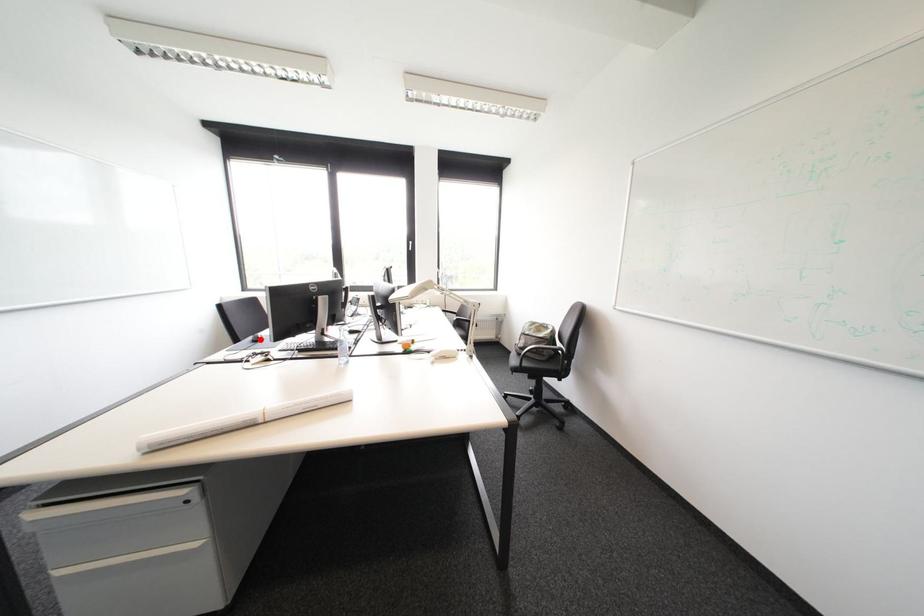
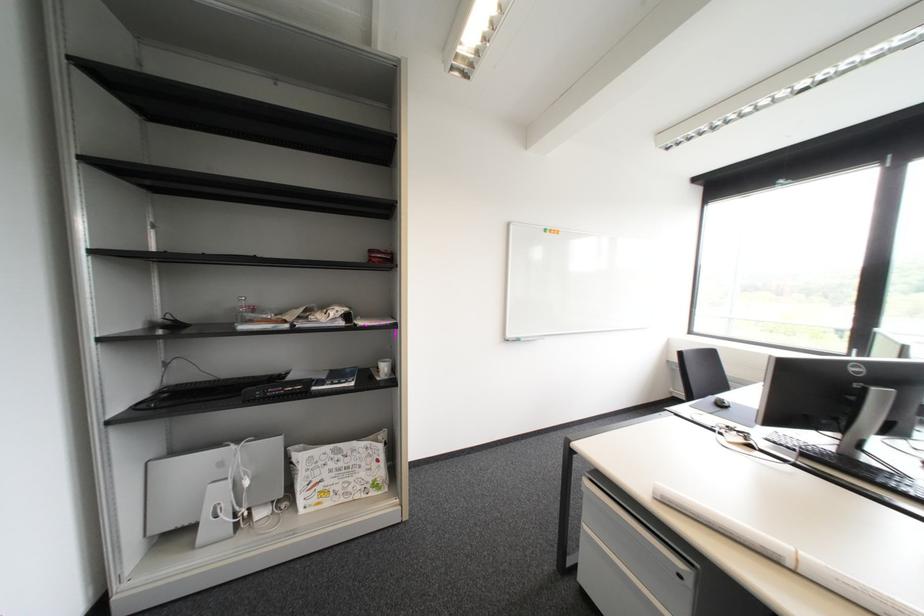
Where in the second image is the point corresponding to the highlighted location from the first image?

(722, 400)